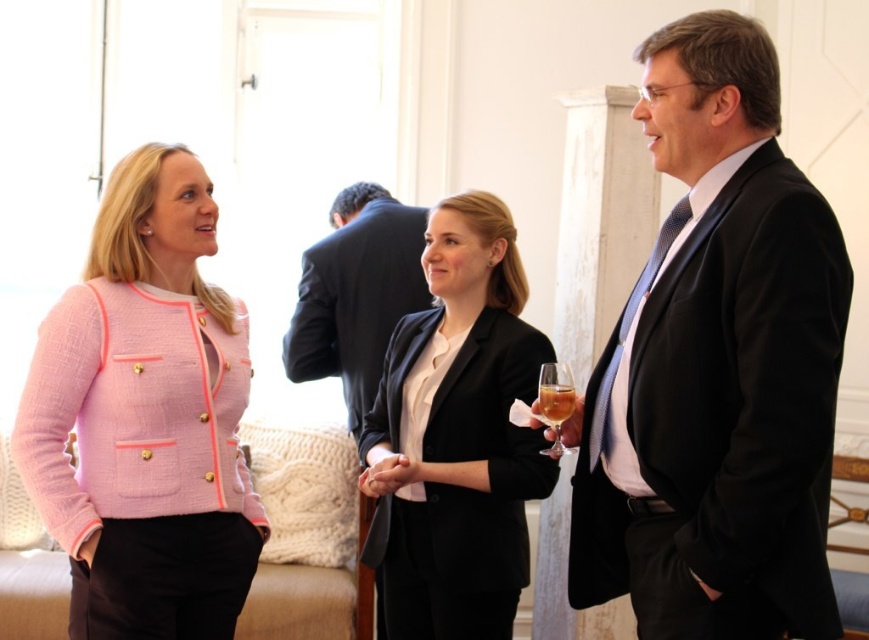
Question: Which object appears farthest from the camera in this image?

Choices:
 (A) matte black suit at right
 (B) matte black blazer at center

Answer: (B)

Question: Estimate the real-world distances between objects in this image. Which object is closer to the translucent glass at right?

Choices:
 (A) matte black suit at right
 (B) dark suit jacket at center
 (C) pink tweed jacket at upper left

Answer: (A)

Question: Does matte black blazer at center have a greater width compared to translucent glass at center?

Choices:
 (A) yes
 (B) no

Answer: (A)

Question: Which object is farther from the camera taking this photo?

Choices:
 (A) matte black blazer at center
 (B) translucent glass at right
 (C) matte black suit at right
 (D) pink tweed jacket at upper left

Answer: (A)

Question: Does dark suit jacket at center have a lesser width compared to translucent glass at center?

Choices:
 (A) yes
 (B) no

Answer: (B)

Question: Is dark suit jacket at center thinner than translucent glass at right?

Choices:
 (A) yes
 (B) no

Answer: (B)